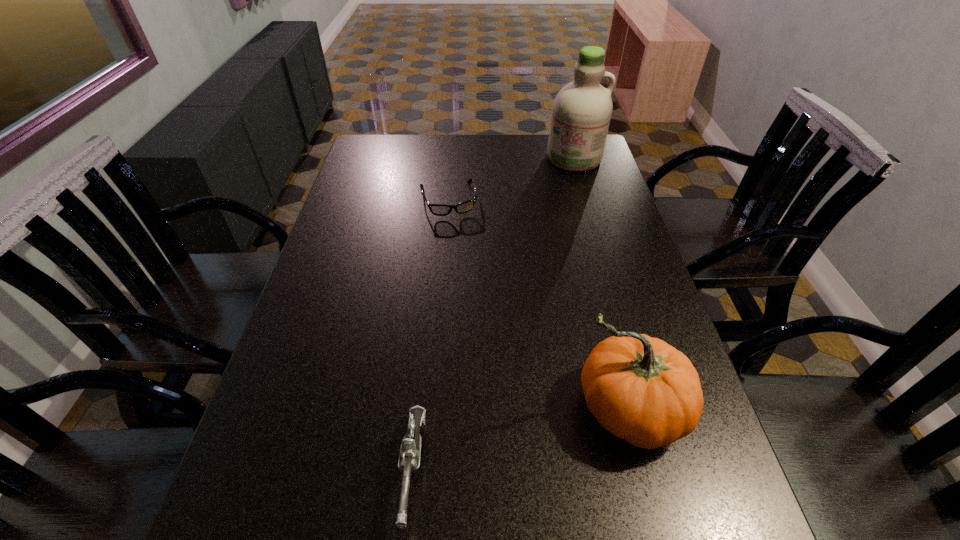
Identify the location of vacant region between the shortest object and the tallest object. This screenshot has width=960, height=540. (511, 179).

The height and width of the screenshot is (540, 960). Identify the location of vacant point located between the gun and the spectacles. (431, 334).

Locate an element on the screen. The height and width of the screenshot is (540, 960). free spot between the tallest object and the second tallest object is located at coordinates (600, 284).

I want to click on vacant space that is in between the gun and the shortest object, so click(x=431, y=334).

I want to click on empty space between the third tallest object and the spectacles, so click(431, 334).

Find the location of a particular element. The height and width of the screenshot is (540, 960). free space between the shortest object and the pumpkin is located at coordinates (537, 305).

At what (x,y) coordinates should I click in order to perform the action: click on object that ranks as the third closest to the second farthest object. Please return your answer as a coordinate pair (x, y). Looking at the image, I should click on (409, 459).

Where is `object that is the second closest to the second farthest object`? object that is the second closest to the second farthest object is located at coordinates (641, 389).

Locate an element on the screen. vacant point that satisfies the following two spatial constraints: 1. on the back side of the third nearest object; 2. on the right side of the farthest object is located at coordinates (452, 158).